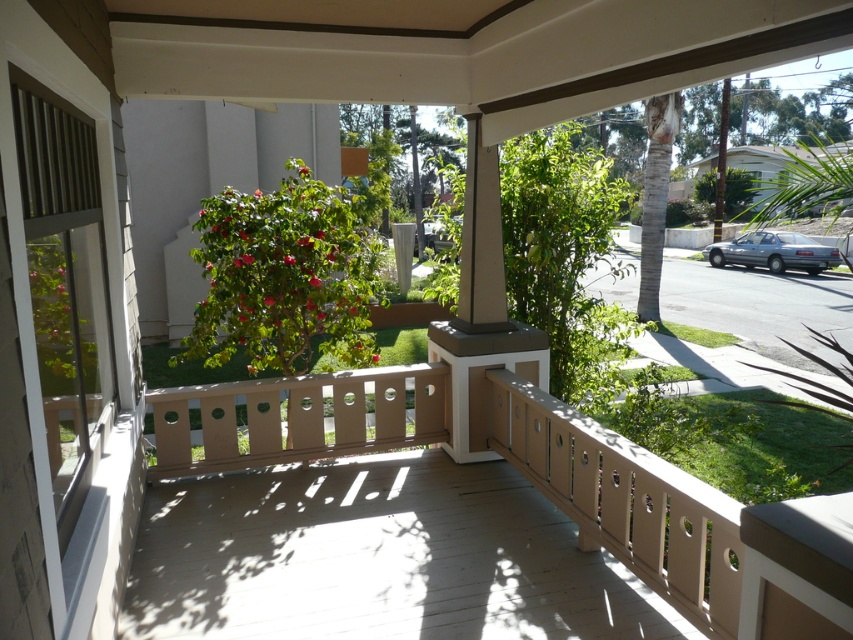
Question: Which point is farther to the camera?

Choices:
 (A) (764, 257)
 (B) (212, 241)

Answer: (A)

Question: Is green leafy bush at center positioned before silver metallic sedan at right?

Choices:
 (A) no
 (B) yes

Answer: (B)

Question: Is green leafy bush at center thinner than silver metallic sedan at right?

Choices:
 (A) no
 (B) yes

Answer: (A)

Question: Is green leafy bush at center wider than silver metallic sedan at right?

Choices:
 (A) yes
 (B) no

Answer: (A)

Question: Which object appears farthest from the camera in this image?

Choices:
 (A) silver metallic sedan at right
 (B) green leafy bush at center

Answer: (A)